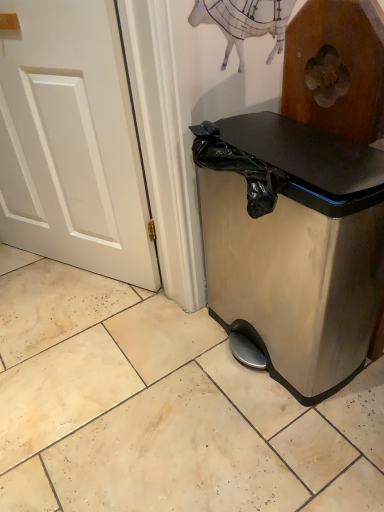
I want to click on satin silver trash can at lower right, so click(x=293, y=244).

The height and width of the screenshot is (512, 384). Describe the element at coordinates (293, 244) in the screenshot. I see `satin silver trash can at lower right` at that location.

Describe the element at coordinates (71, 142) in the screenshot. I see `white painted wood door at left` at that location.

Locate an element on the screen. Image resolution: width=384 pixels, height=512 pixels. white painted wood door at left is located at coordinates [71, 142].

Locate an element on the screen. The height and width of the screenshot is (512, 384). satin silver trash can at lower right is located at coordinates (293, 244).

Is satin silver trash can at lower right at the left side of white painted wood door at left?

No.

Considering the relative positions of satin silver trash can at lower right and white painted wood door at left in the image provided, is satin silver trash can at lower right behind white painted wood door at left?

That is False.

Is point (235, 241) positioned after point (122, 188)?

Yes, point (235, 241) is farther from viewer.

From the image's perspective, is satin silver trash can at lower right located above or below white painted wood door at left?

Clearly, from the image's perspective, satin silver trash can at lower right is below white painted wood door at left.

From a real-world perspective, which is physically below, satin silver trash can at lower right or white painted wood door at left?

satin silver trash can at lower right.

Which of these two, satin silver trash can at lower right or white painted wood door at left, is wider?

satin silver trash can at lower right is wider.

From the picture: Between satin silver trash can at lower right and white painted wood door at left, which one has less height?

satin silver trash can at lower right is shorter.

Is satin silver trash can at lower right smaller than white painted wood door at left?

Actually, satin silver trash can at lower right might be larger than white painted wood door at left.

Is satin silver trash can at lower right inside the boundaries of white painted wood door at left, or outside?

The correct answer is: outside.

Are satin silver trash can at lower right and white painted wood door at left located far from each other?

satin silver trash can at lower right is actually quite close to white painted wood door at left.

Could you tell me if satin silver trash can at lower right is turned towards white painted wood door at left?

No, satin silver trash can at lower right is not oriented towards white painted wood door at left.

How many degrees apart are the facing directions of satin silver trash can at lower right and white painted wood door at left?

They differ by 28 degrees in their facing directions.

There is a satin silver trash can at lower right. Identify the location of door above it (from a real-world perspective). (71, 142).

Does white painted wood door at left appear on the right side of satin silver trash can at lower right?

No.

Considering the positions of objects white painted wood door at left and satin silver trash can at lower right in the image provided, who is behind, white painted wood door at left or satin silver trash can at lower right?

Positioned behind is white painted wood door at left.

Does point (44, 70) come in front of point (368, 243)?

No, it is not.

Looking at this image, from the image's perspective, would you say white painted wood door at left is positioned over satin silver trash can at lower right?

Yes, from the image's perspective, white painted wood door at left is above satin silver trash can at lower right.

From the picture: From a real-world perspective, which object stands above the other?

white painted wood door at left, from a real-world perspective.

Can you confirm if white painted wood door at left is wider than satin silver trash can at lower right?

No, white painted wood door at left is not wider than satin silver trash can at lower right.

Which of these two, white painted wood door at left or satin silver trash can at lower right, stands shorter?

satin silver trash can at lower right.

Which of these two, white painted wood door at left or satin silver trash can at lower right, is smaller?

With smaller size is white painted wood door at left.

Is satin silver trash can at lower right completely or partially inside white painted wood door at left?

Actually, satin silver trash can at lower right is outside white painted wood door at left.

Is the surface of white painted wood door at left in direct contact with satin silver trash can at lower right?

No, white painted wood door at left is not touching satin silver trash can at lower right.

Is white painted wood door at left looking in the opposite direction of satin silver trash can at lower right?

That's not correct — white painted wood door at left is not looking away from satin silver trash can at lower right.

The image size is (384, 512). I want to click on waste container below the white painted wood door at left (from a real-world perspective), so click(293, 244).

The width and height of the screenshot is (384, 512). I want to click on waste container on the right of white painted wood door at left, so click(x=293, y=244).

At what (x,y) coordinates should I click in order to perform the action: click on waste container that is in front of the white painted wood door at left. Please return your answer as a coordinate pair (x, y). Image resolution: width=384 pixels, height=512 pixels. Looking at the image, I should click on (293, 244).